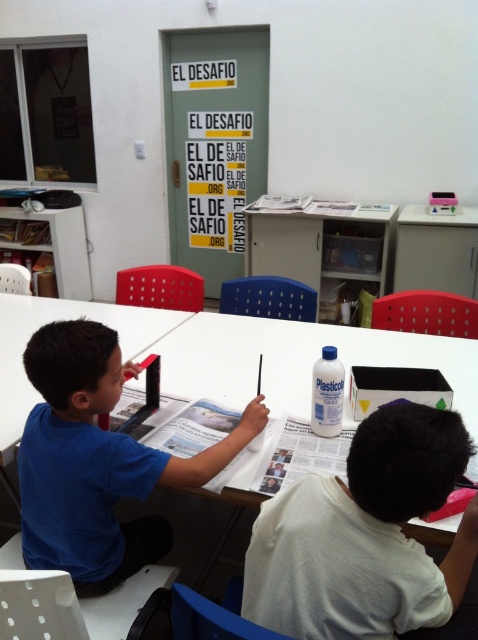
You are a teacher observing a classroom activity. You notice two children at a table wearing white matte shirt at lower right and blue matte shirt at center. Which child takes up more space on the table?

The blue matte shirt at center occupies more space than the white matte shirt at lower right, so the child wearing the blue matte shirt at center takes up more space on the table.

You are a teacher observing the classroom scene. You notice two children wearing shirts labeled as white matte shirt at lower right and blue matte shirt at center. Which child is wearing a thinner shirt?

The white matte shirt at lower right is thinner than the blue matte shirt at center, so the child wearing the white matte shirt at lower right has a thinner shirt.